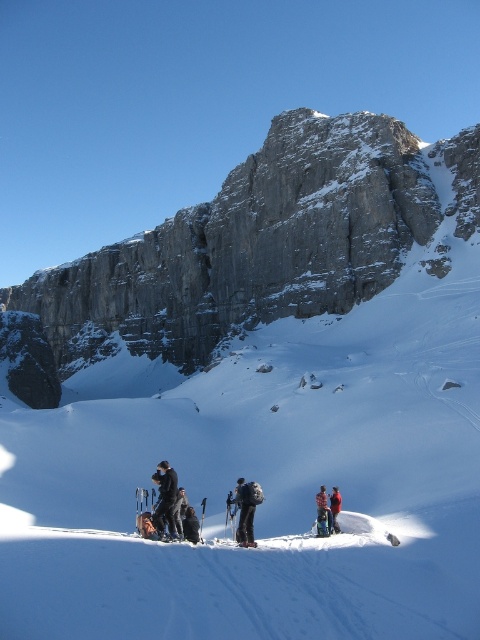
Question: Which of the following is the farthest from the observer?

Choices:
 (A) (176, 484)
 (B) (335, 509)
 (C) (322, 490)
 (D) (357, 252)

Answer: (D)

Question: Is black fabric jacket at lower center to the left of plaid wool jacket at lower center from the viewer's perspective?

Choices:
 (A) no
 (B) yes

Answer: (B)

Question: Does plaid wool jacket at lower center appear on the left side of plaid wool jacket at center?

Choices:
 (A) yes
 (B) no

Answer: (A)

Question: Among these points, which one is nearest to the camera?

Choices:
 (A) (259, 488)
 (B) (319, 508)

Answer: (B)

Question: Which is farther from the black ski suit at center?

Choices:
 (A) black fabric jacket at lower center
 (B) plaid wool jacket at center
 (C) gray rock cliff at upper center

Answer: (C)

Question: Is the position of black ski suit at center more distant than that of plaid wool jacket at lower center?

Choices:
 (A) no
 (B) yes

Answer: (A)